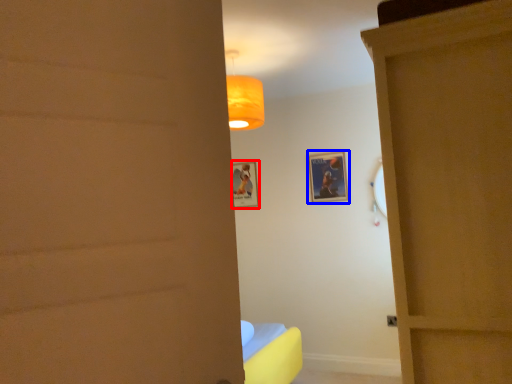
Question: Which object is further to the camera taking this photo, picture frame (highlighted by a red box) or picture frame (highlighted by a blue box)?

Choices:
 (A) picture frame
 (B) picture frame

Answer: (A)